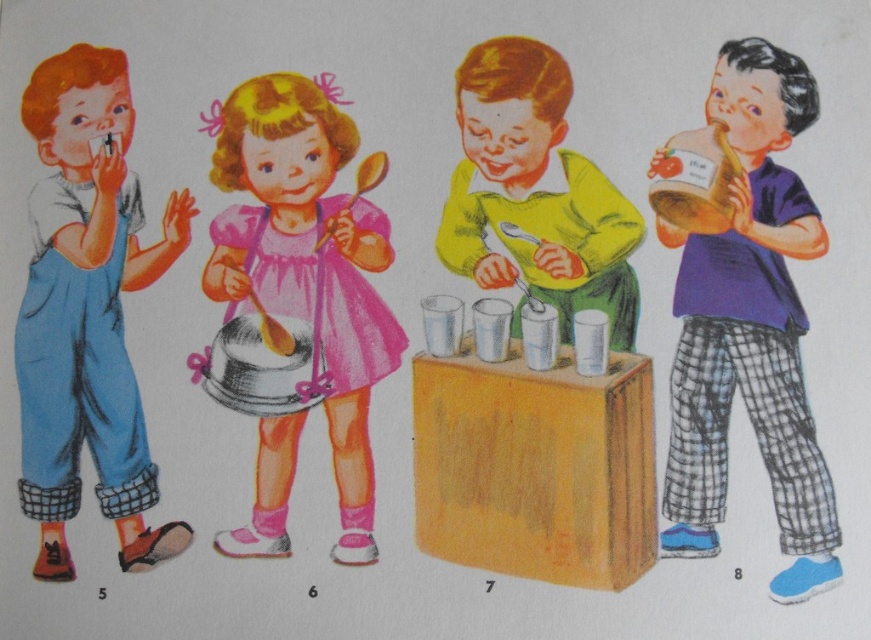
Question: Does pink satin dress at center have a greater width compared to matte yellow shirt at center?

Choices:
 (A) yes
 (B) no

Answer: (A)

Question: Which of the following is the farthest from the observer?

Choices:
 (A) matte yellow shirt at center
 (B) purple cotton shirt at right
 (C) matte blue overalls at left

Answer: (A)

Question: Does purple cotton shirt at right have a lesser width compared to matte yellow shirt at center?

Choices:
 (A) no
 (B) yes

Answer: (B)

Question: Does matte blue overalls at left appear on the right side of pink satin dress at center?

Choices:
 (A) yes
 (B) no

Answer: (B)

Question: Which of the following is the closest to the observer?

Choices:
 (A) (510, 253)
 (B) (24, 301)
 (C) (790, 324)

Answer: (C)

Question: Among these points, which one is farthest from the camera?

Choices:
 (A) (285, 508)
 (B) (559, 134)
 (C) (78, 186)
 (D) (790, 408)

Answer: (C)